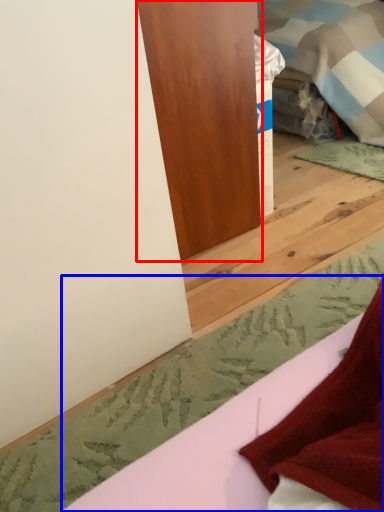
Question: Which of the following is the closest to the observer, furniture (highlighted by a red box) or sheet (highlighted by a blue box)?

Choices:
 (A) furniture
 (B) sheet

Answer: (B)